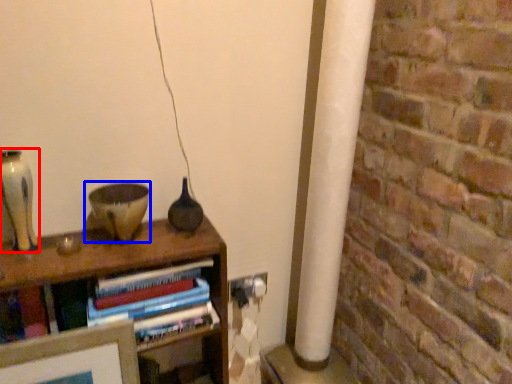
Question: Among these objects, which one is nearest to the camera, glass vase (highlighted by a red box) or candle holder (highlighted by a blue box)?

Choices:
 (A) glass vase
 (B) candle holder

Answer: (A)